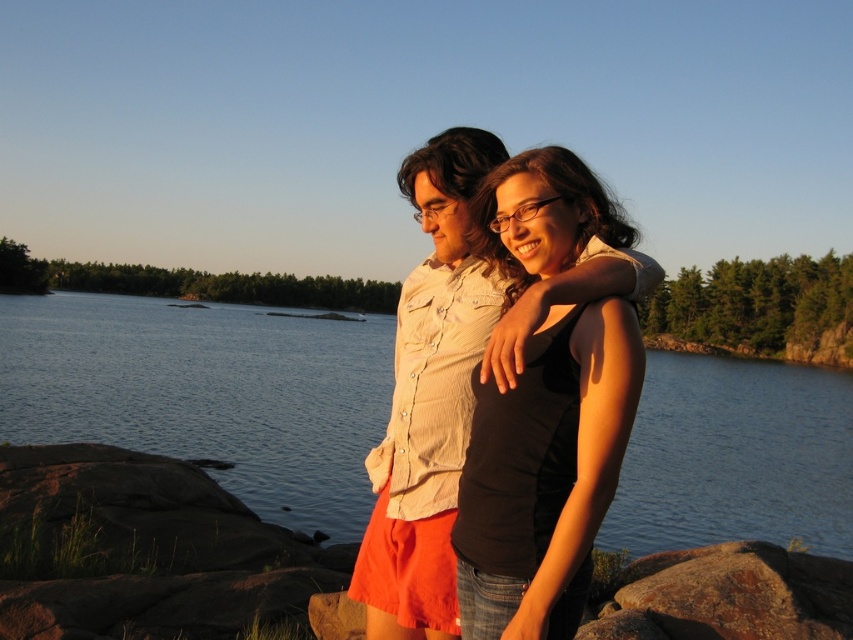
Based on the photo, you are a photographer trying to capture a photo of the clear water at center and the black matte tank top at center. Which object is located to the left of the other?

The clear water at center is positioned on the left side of black matte tank top at center.

You are a photographer planning to take a photo of the clear water at center and the black matte tank top at center. Which object should you focus on first if you want to capture both in a single shot without moving the camera?

The clear water at center is bigger than the black matte tank top at center, so you should focus on the larger object first to ensure depth of field captures both effectively.